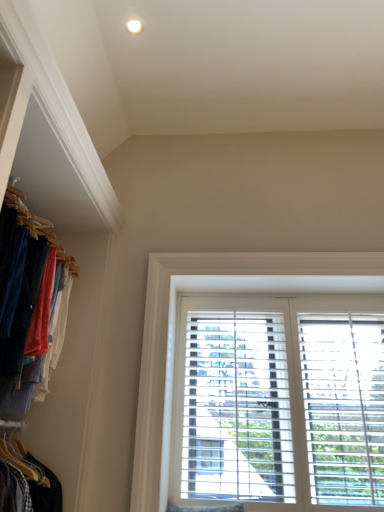
Question: Considering the relative sizes of white wooden blinds at center and matte wooden hangers at left in the image provided, is white wooden blinds at center bigger than matte wooden hangers at left?

Choices:
 (A) no
 (B) yes

Answer: (A)

Question: From a real-world perspective, is white wooden blinds at center physically below matte wooden hangers at left?

Choices:
 (A) no
 (B) yes

Answer: (B)

Question: From a real-world perspective, is white wooden blinds at center physically above matte wooden hangers at left?

Choices:
 (A) yes
 (B) no

Answer: (B)

Question: Does white wooden blinds at center come in front of matte wooden hangers at left?

Choices:
 (A) no
 (B) yes

Answer: (A)

Question: Does white wooden blinds at center contain matte wooden hangers at left?

Choices:
 (A) yes
 (B) no

Answer: (B)

Question: Is white wooden blinds at center to the left of matte wooden hangers at left from the viewer's perspective?

Choices:
 (A) no
 (B) yes

Answer: (A)

Question: Considering the relative positions of matte wooden hangers at left and white wooden blinds at center in the image provided, is matte wooden hangers at left behind white wooden blinds at center?

Choices:
 (A) yes
 (B) no

Answer: (B)

Question: From a real-world perspective, is matte wooden hangers at left positioned under white wooden blinds at center based on gravity?

Choices:
 (A) yes
 (B) no

Answer: (B)

Question: Does matte wooden hangers at left have a lesser height compared to white wooden blinds at center?

Choices:
 (A) yes
 (B) no

Answer: (A)

Question: From the image's perspective, would you say matte wooden hangers at left is shown under white wooden blinds at center?

Choices:
 (A) yes
 (B) no

Answer: (B)

Question: Is matte wooden hangers at left smaller than white wooden blinds at center?

Choices:
 (A) no
 (B) yes

Answer: (A)

Question: Would you say white wooden blinds at center is part of matte wooden hangers at left's contents?

Choices:
 (A) no
 (B) yes

Answer: (A)

Question: Choose the correct answer: Is matte wooden hangers at left inside white wooden blinds at center or outside it?

Choices:
 (A) outside
 (B) inside

Answer: (A)